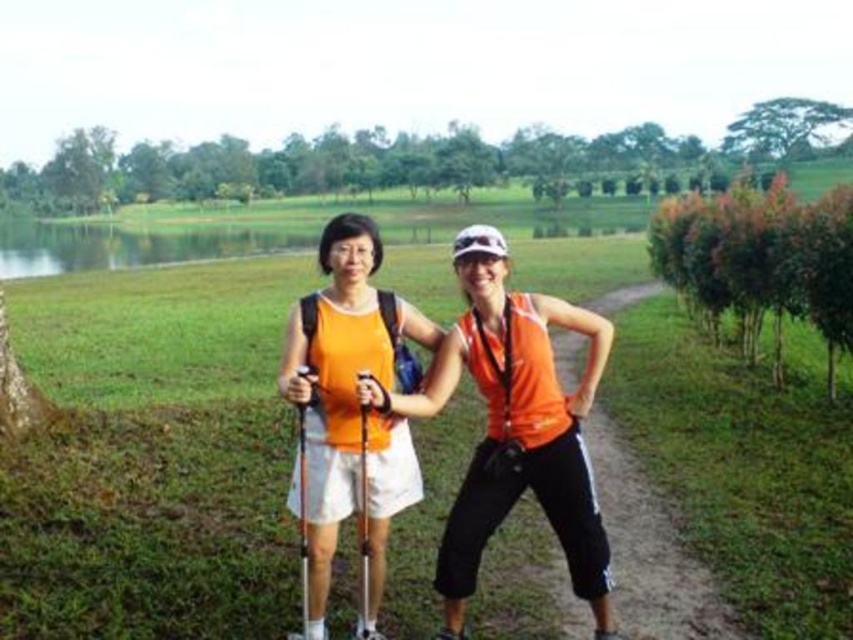
Is orange matte tank top at center shorter than matte orange tank top at center?

Correct, orange matte tank top at center is not as tall as matte orange tank top at center.

Where is `orange matte tank top at center`? The width and height of the screenshot is (853, 640). orange matte tank top at center is located at coordinates (517, 400).

I want to click on orange matte tank top at center, so click(x=517, y=400).